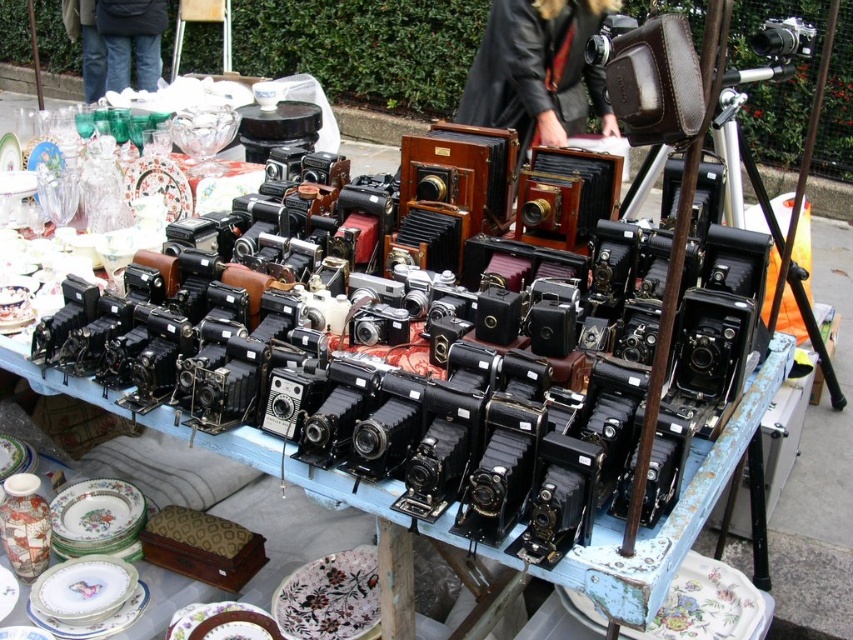
You are at the flea market and want to pick up an item from the table. You notice two points on the table marked as point [595,24] and point [753,33]. Which point is closer to you?

Point [595,24] is closer to the viewer than point [753,33], so you should reach for that one first.

You are a collector looking to purchase a camera from the flea market. You see the brown leather camera case at center and the metallic silver camera at upper right. Which item is located more to the left side of the table?

The brown leather camera case at center is positioned on the left side of the metallic silver camera at upper right, so it is more to the left side of the table.

You are a photographer at the flea market looking for a camera to buy. You see the brown leather camera case at center and the metallic silver camera at upper right. Which object is positioned higher on the table?

The metallic silver camera at upper right is positioned higher on the table than the brown leather camera case at center.